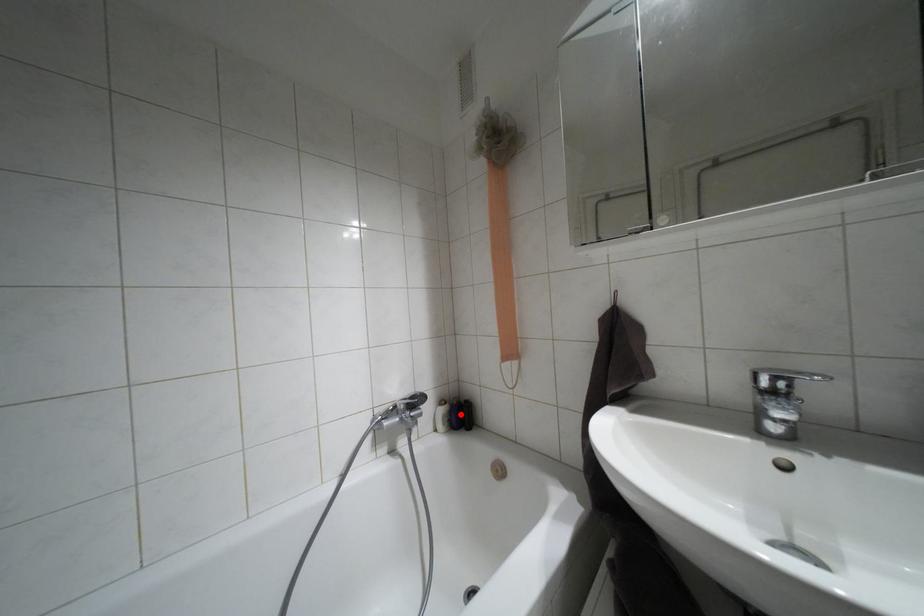
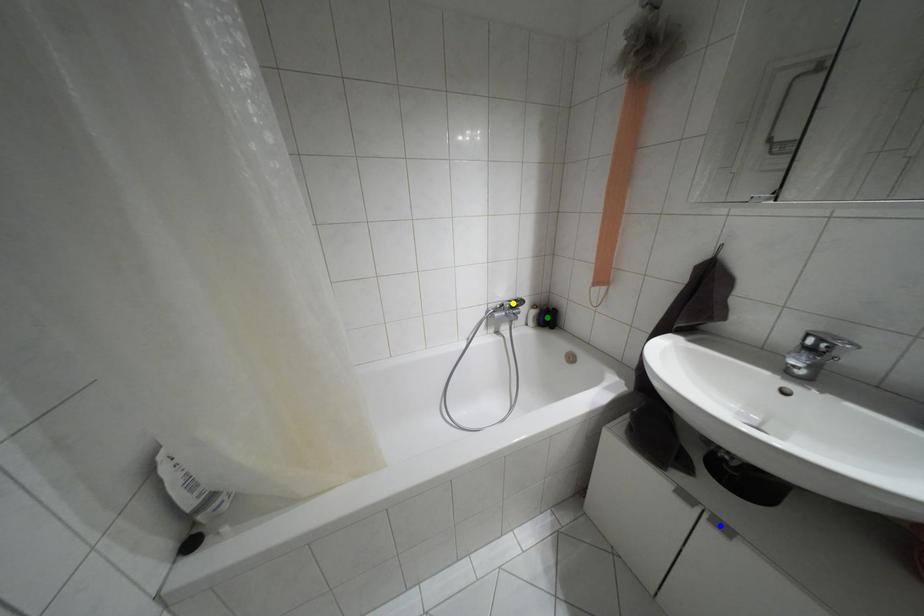
Question: I am providing you with two images of the same scene from different viewpoints. A red point is marked on the first image. You are given multiple points on the second image. In image 2, which mark is for the same physical point as the one in image 1?

Choices:
 (A) blue point
 (B) green point
 (C) yellow point

Answer: (B)